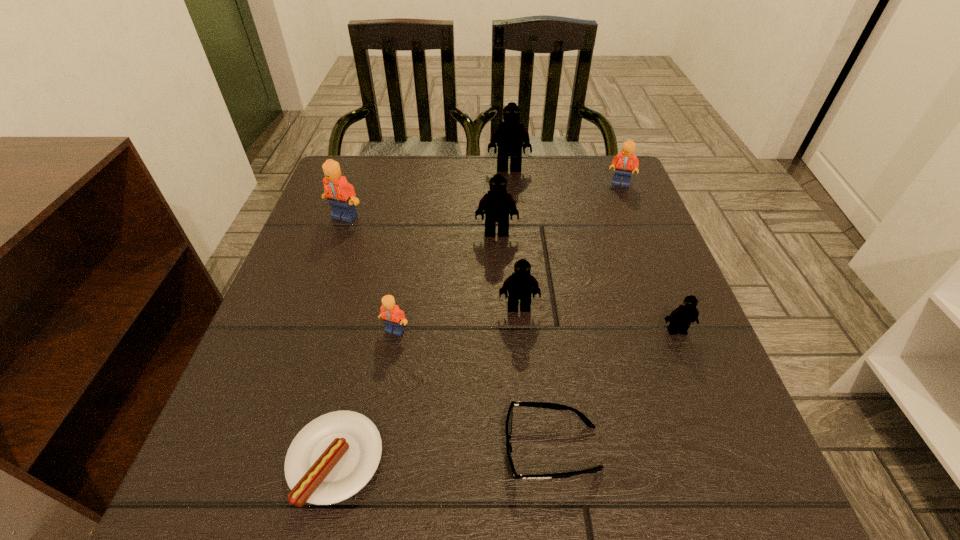
Locate an element on the screen. unoccupied area between the second nearest orange Lego and the biggest black Lego is located at coordinates (427, 193).

I want to click on free point between the rightmost black Lego and the third farthest black Lego, so click(598, 319).

Where is `vacant space that is in between the farthest Lego and the farthest orange Lego`? vacant space that is in between the farthest Lego and the farthest orange Lego is located at coordinates (564, 176).

The image size is (960, 540). I want to click on empty space between the black sunglasses and the leftmost orange Lego, so click(448, 332).

What are the coordinates of `free space between the second farthest black Lego and the eighth nearest object` in the screenshot? It's located at (559, 208).

At what (x,y) coordinates should I click in order to perform the action: click on empty space between the sausage and the rightmost black Lego. Please return your answer as a coordinate pair (x, y). Looking at the image, I should click on (506, 395).

Identify the location of free space between the rightmost black Lego and the biggest orange Lego. (511, 274).

I want to click on free space between the sunglasses and the third smallest black Lego, so click(x=524, y=340).

You are a GUI agent. You are given a task and a screenshot of the screen. Output one action in this format:
    pyautogui.click(x=<x>, y=<y>)
    Task: Click on the free spot between the nearest orange Lego and the sunglasses
    The height and width of the screenshot is (540, 960).
    Given the screenshot: What is the action you would take?
    pyautogui.click(x=473, y=389)

Choose which object is the fourth nearest neighbor to the second orange Lego from left to right. Please provide its 2D coordinates. Your answer should be formatted as a tuple, i.e. [(x, y)], where the tuple contains the x and y coordinates of a point satisfying the conditions above.

[(496, 204)]